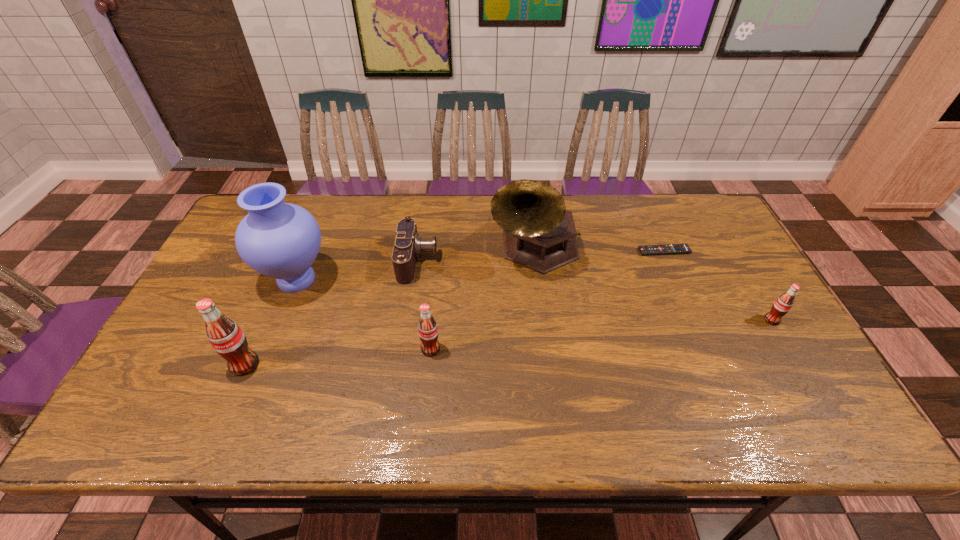
Where is `camera`? The width and height of the screenshot is (960, 540). camera is located at coordinates (408, 245).

Identify the location of free region located 0.330m on the back of the fifth shortest object. pos(289,261).

The height and width of the screenshot is (540, 960). In order to click on vacant space located on the back of the second soda from right to left in this screenshot , I will do `click(438, 276)`.

Find the location of a particular element. vacant space located 0.140m on the back of the shortest soda is located at coordinates (747, 277).

Locate an element on the screen. The image size is (960, 540). vacant space located 0.390m on the right of the vase is located at coordinates (468, 279).

This screenshot has width=960, height=540. What are the coordinates of `vacant space located 0.230m on the horn direction of the phonograph record` in the screenshot? It's located at (547, 349).

Find the location of a particular element. This screenshot has width=960, height=540. free space located on the left of the shortest object is located at coordinates (528, 251).

The width and height of the screenshot is (960, 540). Identify the location of free space located on the front-facing side of the camera. (569, 261).

This screenshot has width=960, height=540. In order to click on phonograph record that is at the far edge in this screenshot , I will do `click(539, 233)`.

Find the location of a particular element. The image size is (960, 540). camera that is at the far edge is located at coordinates (408, 245).